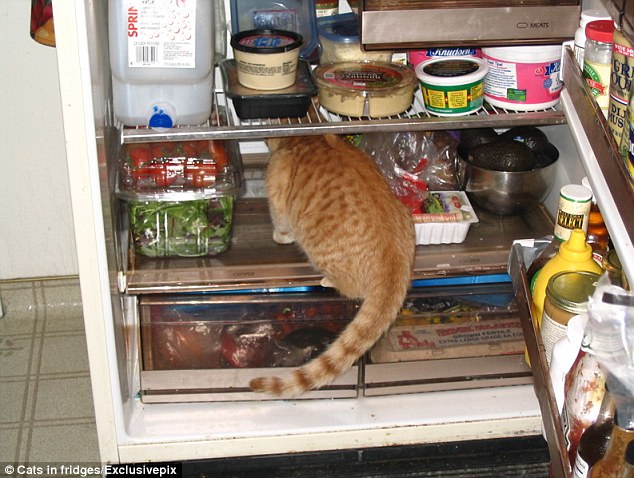
Where is `water jug`? water jug is located at coordinates (204, 87).